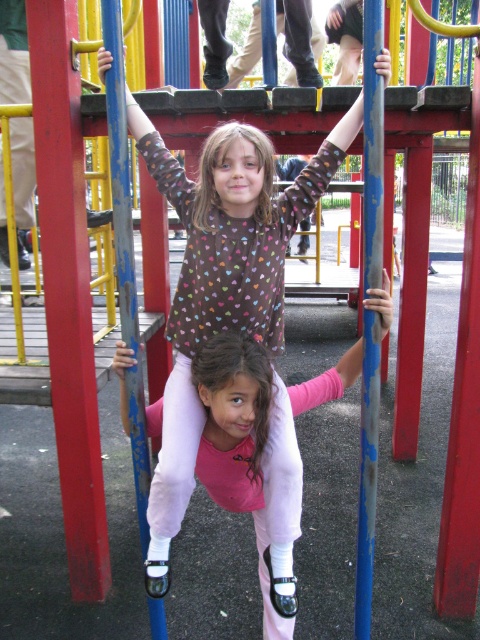
You are a parent watching your children play at the playground. You notice the brown dotted sweater at center and the blue painted metal pole at center. Which object is closer to you?

The brown dotted sweater at center is closer to you because the blue painted metal pole at center is behind it.

You are a parent trying to locate your child in the playground. You see the brown dotted sweater at center and the blue painted metal pole at center. Which one is positioned more to the left side of the scene?

The brown dotted sweater at center is positioned more to the left side of the scene compared to the blue painted metal pole at center.